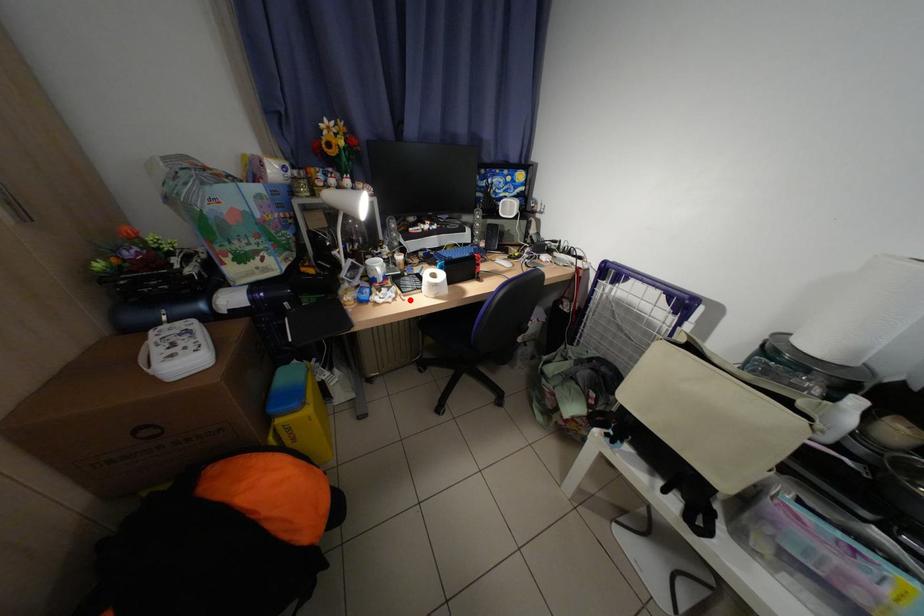
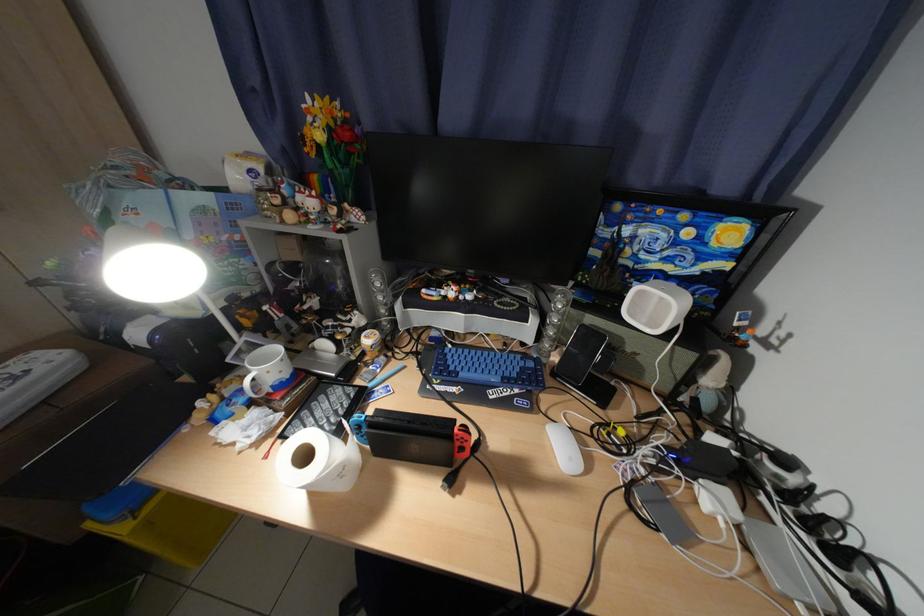
In the second image, find the point that corresponds to the highlighted location in the first image.

(282, 444)